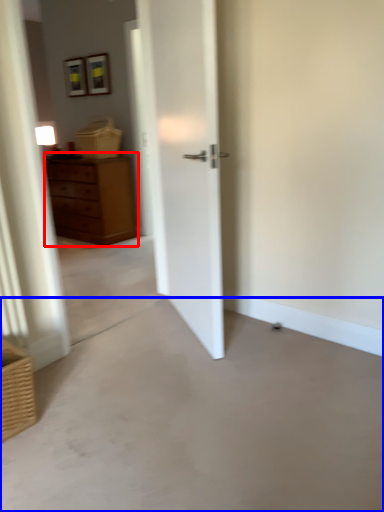
Question: Which object is further to the camera taking this photo, chest of drawers (highlighted by a red box) or concrete (highlighted by a blue box)?

Choices:
 (A) chest of drawers
 (B) concrete

Answer: (A)